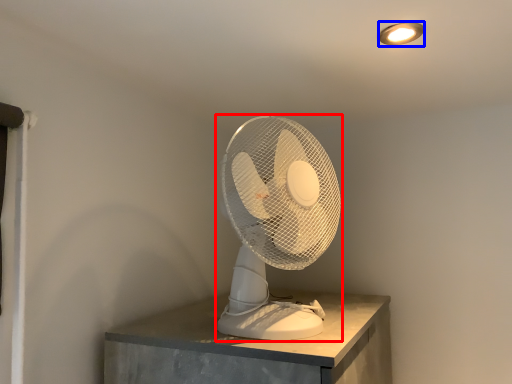
Question: Among these objects, which one is nearest to the camera, mechanical fan (highlighted by a red box) or lamp (highlighted by a blue box)?

Choices:
 (A) mechanical fan
 (B) lamp

Answer: (A)